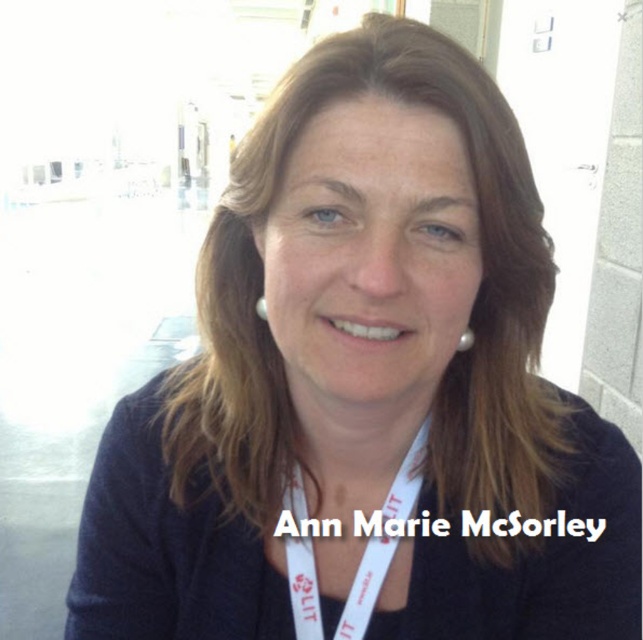
Question: Which of the following is the closest to the observer?

Choices:
 (A) (458, 340)
 (B) (390, 561)
 (C) (376, 476)
 (D) (264, 300)

Answer: (D)

Question: Does skinsmoothneck at center appear on the right side of pearlelegantearring at upper center?

Choices:
 (A) yes
 (B) no

Answer: (B)

Question: Does skinsmoothneck at center have a lesser width compared to pearlelegantearring at upper center?

Choices:
 (A) no
 (B) yes

Answer: (A)

Question: Which point is farther to the camera?

Choices:
 (A) pearlelegantearring at upper center
 (B) pearl earring at upper center
 (C) white fabric lanyard at center

Answer: (C)

Question: From the image, what is the correct spatial relationship of skinsmoothneck at center in relation to pearl earring at upper center?

Choices:
 (A) right
 (B) left

Answer: (A)

Question: Among these points, which one is nearest to the camera?

Choices:
 (A) (374, 408)
 (B) (469, 333)

Answer: (A)